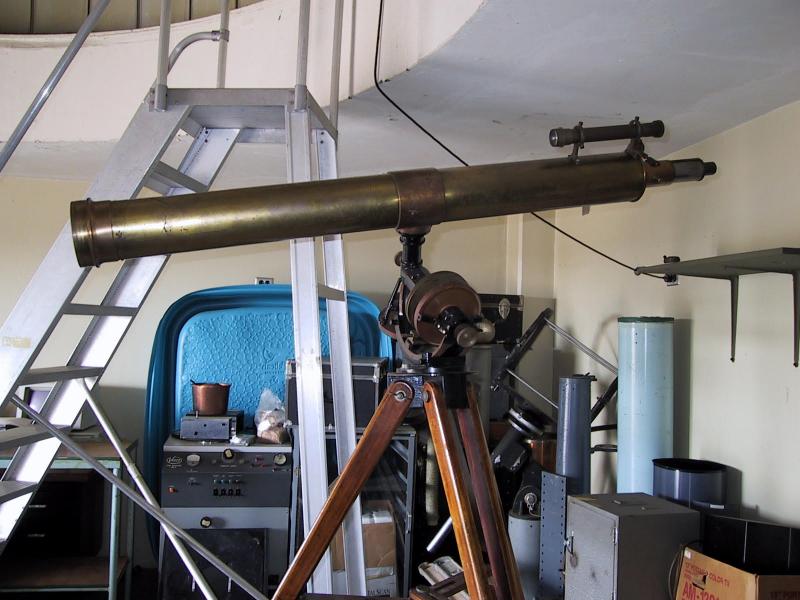
In order to click on back wall in this screenshot , I will do `click(362, 262)`.